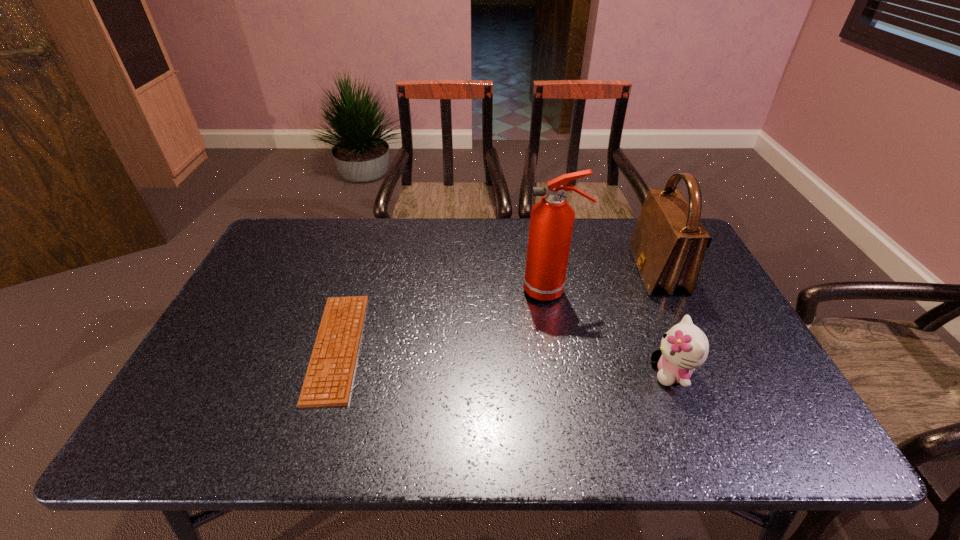
Where is `the tallest object`? the tallest object is located at coordinates (x=551, y=222).

The image size is (960, 540). I want to click on fire extinguisher, so click(x=551, y=222).

Find the location of `the second tallest object`. the second tallest object is located at coordinates (668, 244).

Where is `kitten`? kitten is located at coordinates (684, 347).

Locate an element on the screen. computer keyboard is located at coordinates (328, 381).

Locate an element on the screen. the leftmost object is located at coordinates (328, 381).

Where is `vacant point located 0.220m at the nozzle of the fire extinguisher`? The image size is (960, 540). vacant point located 0.220m at the nozzle of the fire extinguisher is located at coordinates (447, 290).

Where is `vacant space positioned 0.340m at the nozzle of the fire extinguisher`? vacant space positioned 0.340m at the nozzle of the fire extinguisher is located at coordinates (406, 290).

Where is `vacant area situated at the nozzle of the fire extinguisher`? This screenshot has width=960, height=540. vacant area situated at the nozzle of the fire extinguisher is located at coordinates (447, 290).

Identify the location of free point located 0.270m on the front flap of the third shortest object. This screenshot has height=540, width=960. (547, 271).